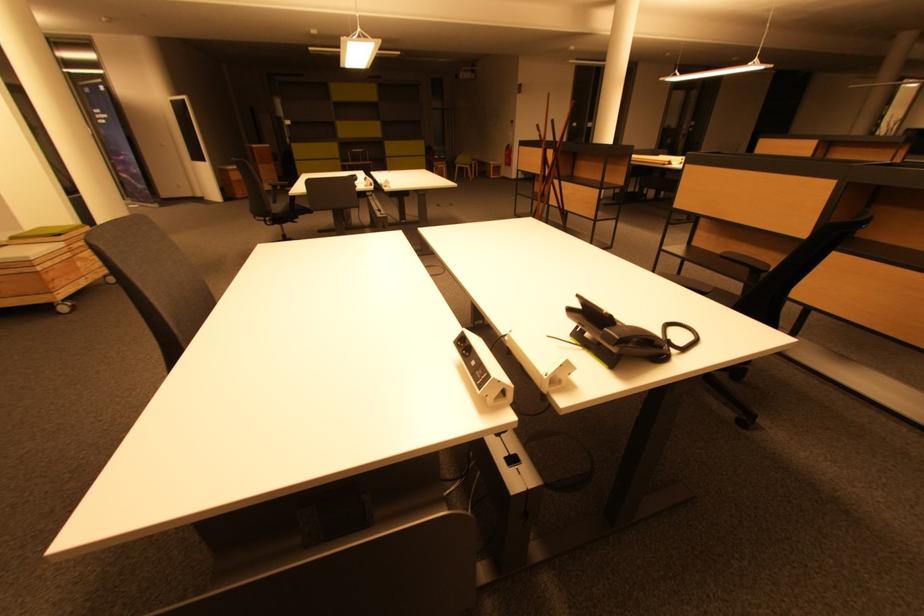
The width and height of the screenshot is (924, 616). What do you see at coordinates (285, 209) in the screenshot? I see `the chair sitting surface` at bounding box center [285, 209].